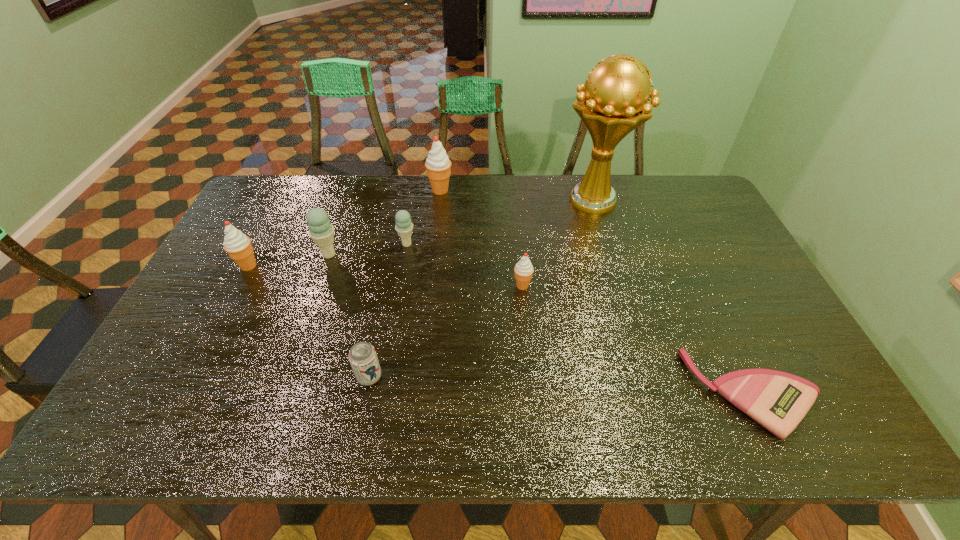
The height and width of the screenshot is (540, 960). What are the coordinates of `the rightmost icecream` in the screenshot? It's located at (523, 269).

Find the location of a particular element. The height and width of the screenshot is (540, 960). the nearest icecream is located at coordinates (523, 269).

At what (x,y) coordinates should I click in order to perform the action: click on the seventh tallest object. Please return your answer as a coordinate pair (x, y). The height and width of the screenshot is (540, 960). Looking at the image, I should click on (362, 356).

Locate an element on the screen. This screenshot has width=960, height=540. the shortest object is located at coordinates coord(778,401).

Identify the location of pink wristlet. The width and height of the screenshot is (960, 540). (778, 401).

The image size is (960, 540). I want to click on vacant space located at the front of the gold trophy_cup where the globe is prominent, so click(x=605, y=240).

This screenshot has height=540, width=960. Identify the location of vacant position located on the front of the farthest red icecream. (439, 208).

Find the location of a particular element. blank space located 0.380m on the back of the leftmost icecream is located at coordinates (290, 185).

The height and width of the screenshot is (540, 960). I want to click on vacant area located on the front of the bigger blue ice cream, so click(314, 298).

Identify the location of free space located on the front of the smaller blue ice cream. This screenshot has height=540, width=960. (392, 334).